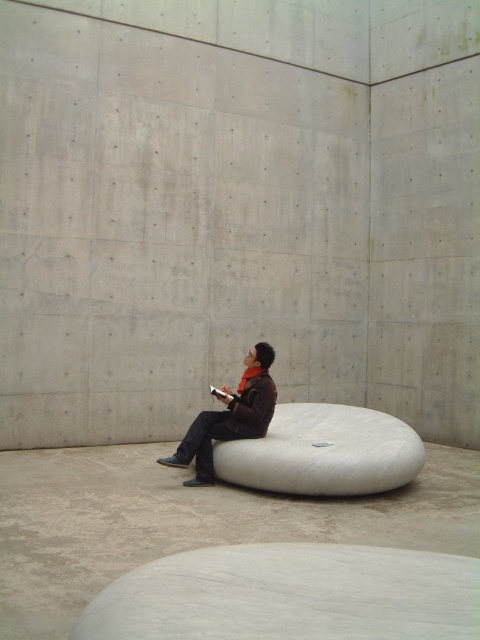
You are organizing a small gathering in the room and need to place a 1.2 meter wide coffee table between the white matte bean bag chair at center and the dark brown leather jacket at center. Is there enough space for the coffee table?

The white matte bean bag chair at center is positioned on the right side of the dark brown leather jacket at center. Since the objects are placed next to each other with the chair on the right, there is insufficient space to fit a 1.2 meter wide coffee table between them.

You are designing a living room and want to place both the white smooth concrete at center and the white matte bean bag chair at center side by side. Given their widths, which one should be placed first to ensure they fit within a 2.5 meter wide space?

The white smooth concrete at center has a smaller width than the white matte bean bag chair at center. To fit both within the 2.5 meter space, place the wider white matte bean bag chair at center first, then the narrower white smooth concrete at center.